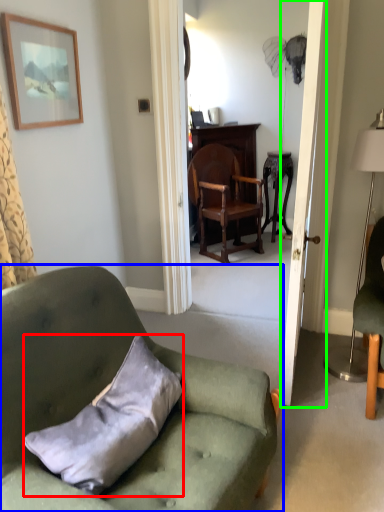
Question: Which object is positioned farthest from pillow (highlighted by a red box)? Select from chair (highlighted by a blue box) and door (highlighted by a green box).

Choices:
 (A) chair
 (B) door

Answer: (B)